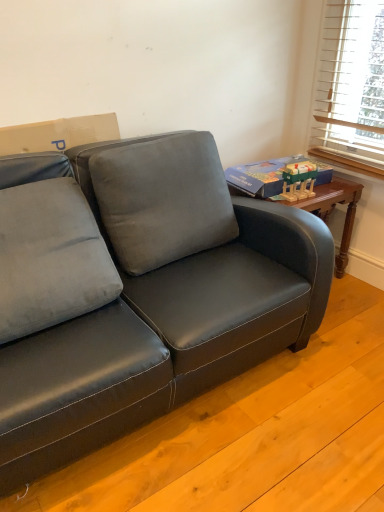
Question: Should I look upward or downward to see velvet gray pillow at center, the 2th pillow in the left-to-right sequence?

Choices:
 (A) up
 (B) down

Answer: (A)

Question: Does satin black couch at lower left touch suede-like gray pillow at left, acting as the 1th pillow starting from the left?

Choices:
 (A) no
 (B) yes

Answer: (A)

Question: Does satin black couch at lower left turn towards suede-like gray pillow at left, arranged as the 2th pillow when viewed from the right?

Choices:
 (A) no
 (B) yes

Answer: (A)

Question: Is satin black couch at lower left closer to camera compared to suede-like gray pillow at left, arranged as the 2th pillow when viewed from the right?

Choices:
 (A) no
 (B) yes

Answer: (B)

Question: Is satin black couch at lower left turned away from suede-like gray pillow at left, arranged as the 2th pillow when viewed from the right?

Choices:
 (A) no
 (B) yes

Answer: (A)

Question: Does satin black couch at lower left appear on the right side of suede-like gray pillow at left, arranged as the 2th pillow when viewed from the right?

Choices:
 (A) no
 (B) yes

Answer: (B)

Question: From a real-world perspective, does satin black couch at lower left stand above suede-like gray pillow at left, arranged as the 2th pillow when viewed from the right?

Choices:
 (A) no
 (B) yes

Answer: (A)

Question: Could wooden block toy at upper right be considered to be inside velvet gray pillow at center, the 2th pillow in the left-to-right sequence?

Choices:
 (A) no
 (B) yes

Answer: (A)

Question: Is velvet gray pillow at center, the 2th pillow in the left-to-right sequence, turned away from wooden block toy at upper right?

Choices:
 (A) yes
 (B) no

Answer: (B)

Question: From a real-world perspective, is velvet gray pillow at center, the 2th pillow in the left-to-right sequence, on wooden block toy at upper right?

Choices:
 (A) no
 (B) yes

Answer: (A)

Question: Does velvet gray pillow at center, arranged as the first pillow when viewed from the right, appear on the left side of wooden block toy at upper right?

Choices:
 (A) no
 (B) yes

Answer: (B)

Question: Does velvet gray pillow at center, the 2th pillow in the left-to-right sequence, have a larger size compared to wooden block toy at upper right?

Choices:
 (A) yes
 (B) no

Answer: (A)

Question: Considering the relative positions of velvet gray pillow at center, arranged as the first pillow when viewed from the right, and wooden block toy at upper right in the image provided, is velvet gray pillow at center, arranged as the first pillow when viewed from the right, to the right of wooden block toy at upper right from the viewer's perspective?

Choices:
 (A) no
 (B) yes

Answer: (A)

Question: From a real-world perspective, is velvet gray pillow at center, arranged as the first pillow when viewed from the right, below satin black couch at lower left?

Choices:
 (A) yes
 (B) no

Answer: (B)